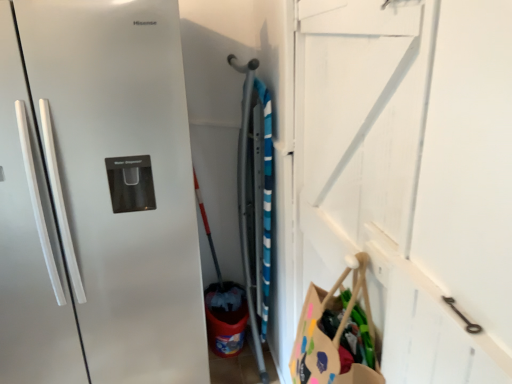
Question: Would you say white wooden door at upper right is inside or outside satin white refrigerator handles at left?

Choices:
 (A) outside
 (B) inside

Answer: (A)

Question: Is white wooden door at upper right in front of or behind satin white refrigerator handles at left in the image?

Choices:
 (A) front
 (B) behind

Answer: (B)

Question: Based on their sizes in the image, would you say white wooden door at upper right is bigger or smaller than satin white refrigerator handles at left?

Choices:
 (A) big
 (B) small

Answer: (A)

Question: Does point (18, 367) appear closer or farther from the camera than point (471, 163)?

Choices:
 (A) farther
 (B) closer

Answer: (A)

Question: Based on their positions, is satin white refrigerator handles at left located to the left or right of white wooden door at upper right?

Choices:
 (A) left
 (B) right

Answer: (A)

Question: In the image, is satin white refrigerator handles at left positioned in front of or behind white wooden door at upper right?

Choices:
 (A) front
 (B) behind

Answer: (A)

Question: From a real-world perspective, is satin white refrigerator handles at left positioned above or below white wooden door at upper right?

Choices:
 (A) above
 (B) below

Answer: (A)